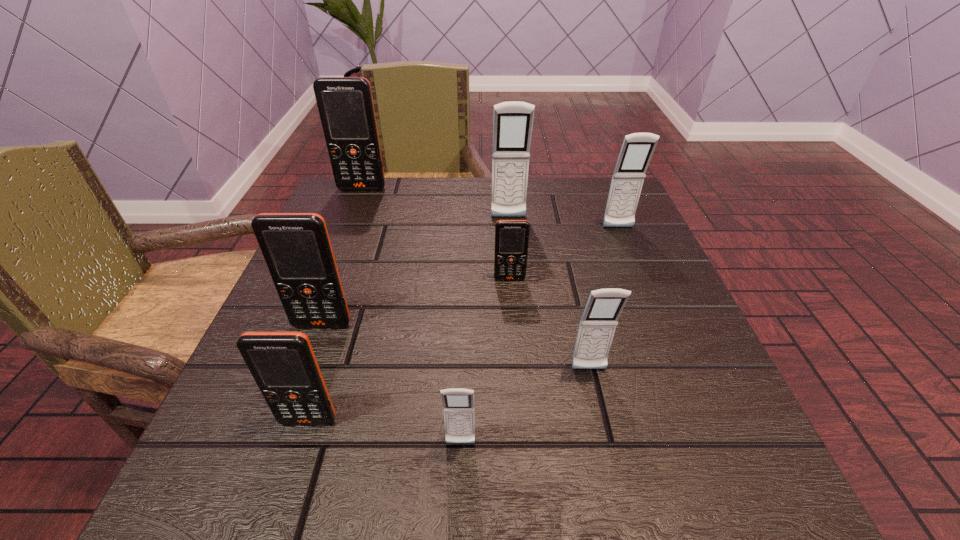
What are the coordinates of `free spot at the left edge of the desktop` in the screenshot? It's located at (351, 291).

Locate an element on the screen. vacant space at the far left corner of the desktop is located at coordinates (367, 200).

In the image, there is a desktop. In order to click on vacant space at the far right corner in this screenshot , I will do [x=636, y=228].

Where is `vacant space at the near right corner of the desktop`? vacant space at the near right corner of the desktop is located at coordinates coord(733,484).

Locate an element on the screen. This screenshot has width=960, height=540. vacant space that's between the rightmost object and the farthest object is located at coordinates (491, 208).

You are a GUI agent. You are given a task and a screenshot of the screen. Output one action in this format:
    pyautogui.click(x=<x>, y=<y>)
    Task: Click on the free space that is in between the fourth farthest object and the seventh farthest object
    This screenshot has width=960, height=540.
    Given the screenshot: What is the action you would take?
    pyautogui.click(x=409, y=350)

This screenshot has height=540, width=960. I want to click on free space between the seventh object from left to right and the second farthest object, so click(x=549, y=294).

This screenshot has width=960, height=540. I want to click on vacant area that lies between the third farthest gray cellular telephone and the farthest object, so click(x=475, y=279).

Locate an element on the screen. The width and height of the screenshot is (960, 540). vacant space in between the second gray cellular telephone from right to left and the fourth farthest object is located at coordinates (549, 325).

Image resolution: width=960 pixels, height=540 pixels. I want to click on empty space that is in between the rightmost object and the second farthest object, so click(564, 223).